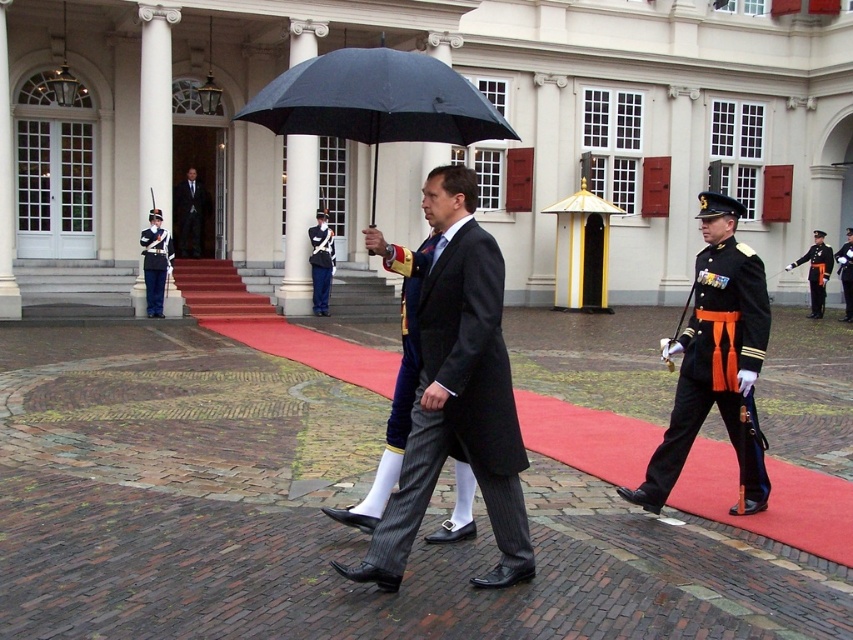
Question: Considering the real-world distances, which object is closest to the matte black coat at center?

Choices:
 (A) black matte umbrella at center
 (B) shiny silver helmet at left
 (C) black uniform at center

Answer: (C)

Question: Observing the image, what is the correct spatial positioning of white stone building at center in reference to shiny silver helmet at left?

Choices:
 (A) below
 (B) above

Answer: (B)

Question: Observing the image, what is the correct spatial positioning of black suit at center in reference to uniformed soldier at center?

Choices:
 (A) below
 (B) above

Answer: (B)

Question: Which object appears closest to the camera in this image?

Choices:
 (A) white stone building at center
 (B) black suit at center
 (C) uniformed soldier at center
 (D) shiny silver helmet at left

Answer: (A)

Question: Which object is farther from the camera taking this photo?

Choices:
 (A) matte black coat at center
 (B) white stone building at center

Answer: (B)

Question: Is black suit at center positioned at the back of shiny silver helmet at left?

Choices:
 (A) yes
 (B) no

Answer: (A)